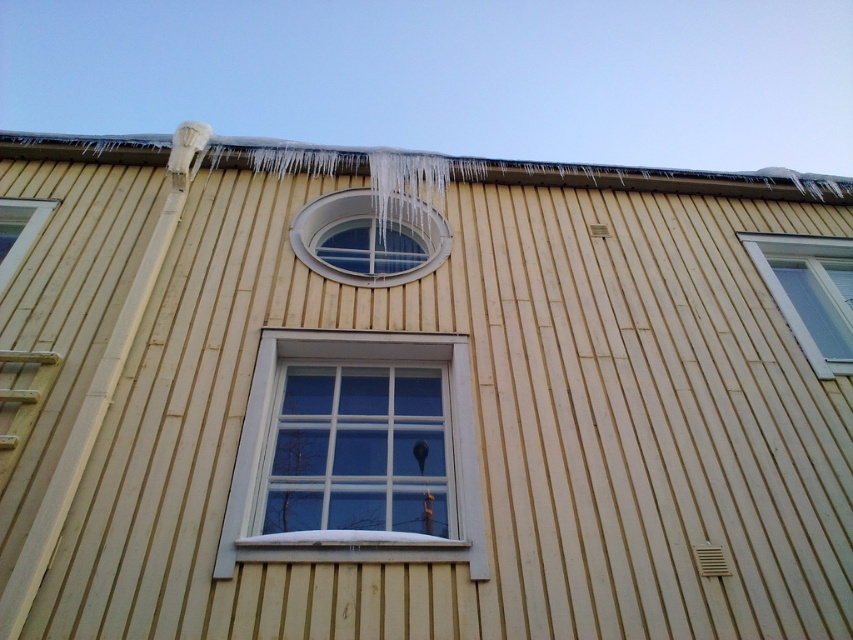
Question: Which point is closer to the camera taking this photo?

Choices:
 (A) (112, 144)
 (B) (9, 264)
 (C) (302, 220)

Answer: (B)

Question: Which of the following is the farthest from the observer?

Choices:
 (A) icicle ice at upper
 (B) white plastic window at upper right
 (C) white painted wood window frame at center
 (D) clear glass window at center

Answer: (A)

Question: Which point appears closest to the camera in this image?

Choices:
 (A) (0, 269)
 (B) (299, 211)
 (C) (409, 554)

Answer: (C)

Question: Does white painted wood window frame at center have a greater width compared to white plastic window at upper right?

Choices:
 (A) yes
 (B) no

Answer: (A)

Question: Is the position of white plastic window at upper right less distant than that of clear glass window at upper left?

Choices:
 (A) yes
 (B) no

Answer: (B)

Question: Is icicle ice at upper thinner than clear glass window at upper left?

Choices:
 (A) yes
 (B) no

Answer: (B)